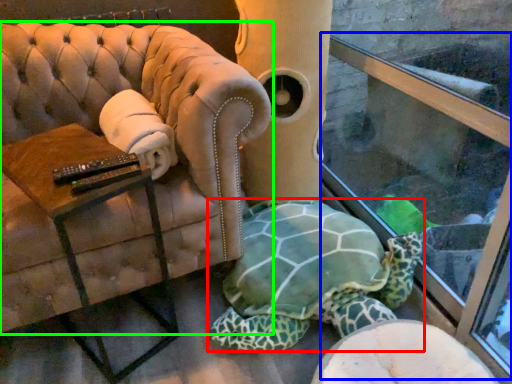
Question: Which object is positioned closest to tortoise (highlighted by a red box)? Select from shop window (highlighted by a blue box) and chair (highlighted by a green box).

Choices:
 (A) shop window
 (B) chair

Answer: (A)